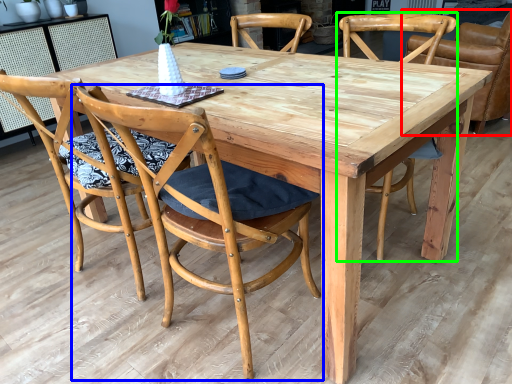
Question: Which is farther away from chair (highlighted by a red box)? chair (highlighted by a blue box) or chair (highlighted by a green box)?

Choices:
 (A) chair
 (B) chair

Answer: (A)